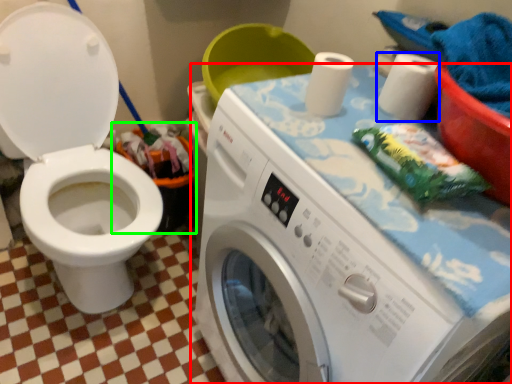
Question: Considering the real-world distances, which object is closest to washing machine (highlighted by a red box)? toilet paper (highlighted by a blue box) or recycling bin (highlighted by a green box).

Choices:
 (A) toilet paper
 (B) recycling bin

Answer: (A)